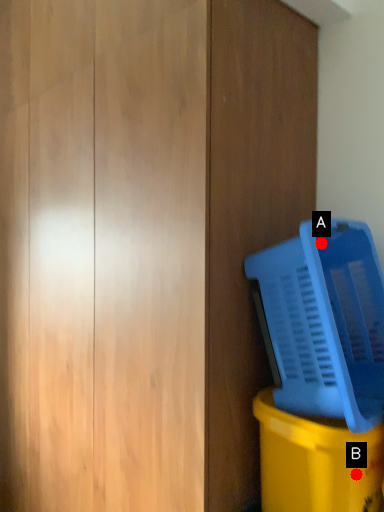
Question: Two points are circled on the image, labeled by A and B beside each circle. Which point is closer to the camera?

Choices:
 (A) A is closer
 (B) B is closer

Answer: (B)